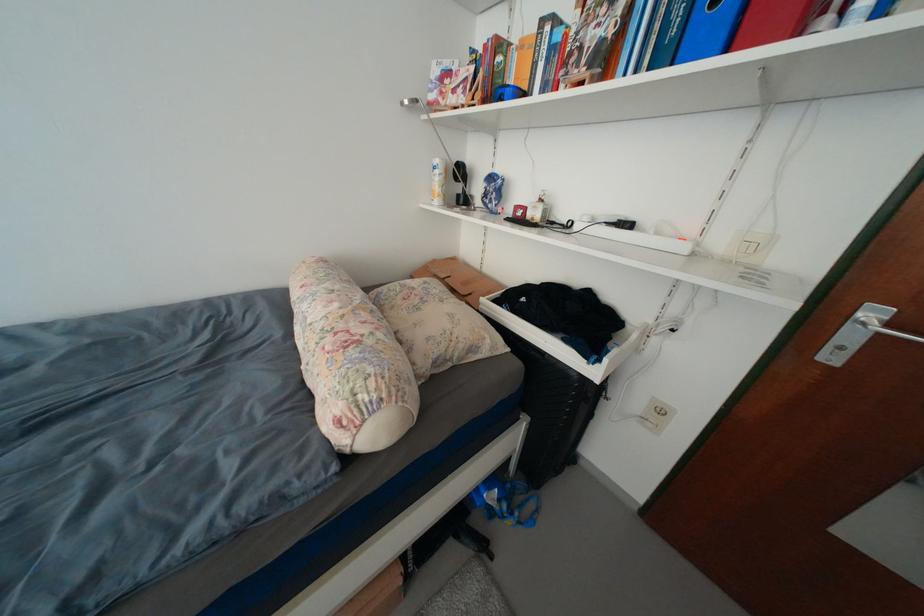
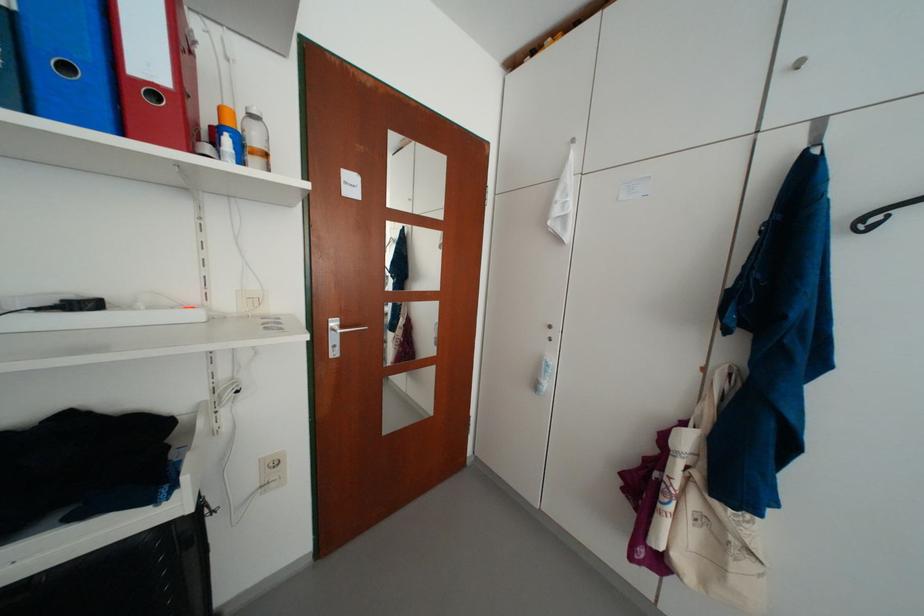
Locate, in the second image, the point that corresponds to point 727,245 in the first image.

(236, 306)